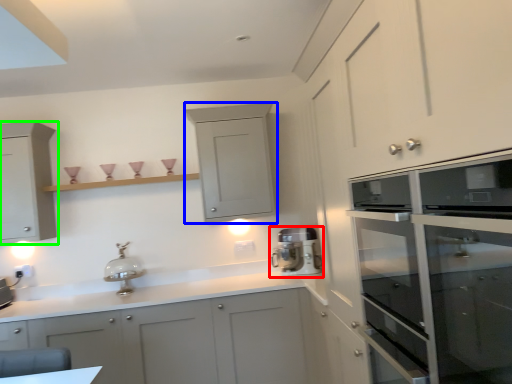
Question: Which is farther away from home appliance (highlighted by a red box)? cabinetry (highlighted by a blue box) or cabinetry (highlighted by a green box)?

Choices:
 (A) cabinetry
 (B) cabinetry

Answer: (B)